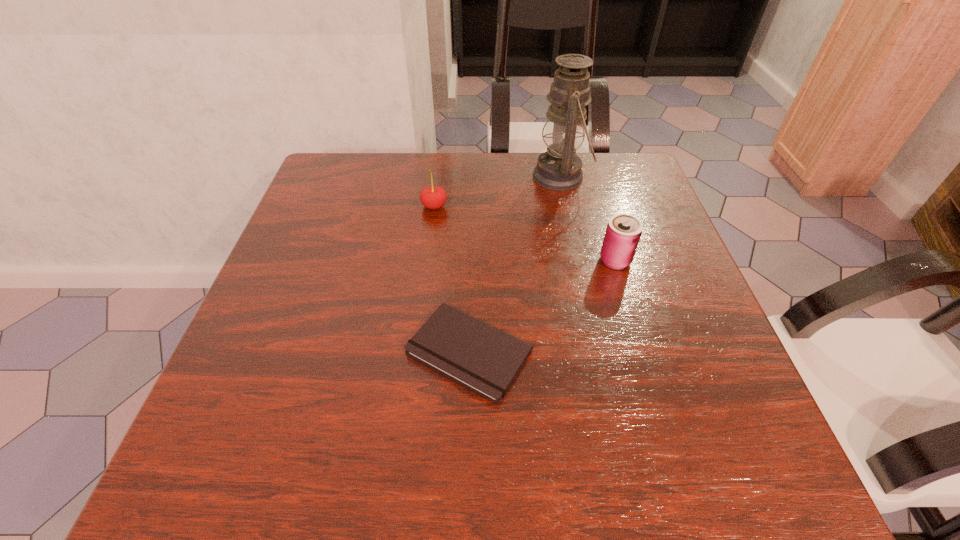
Identify the location of object that is the closest one to the oil lamp. The width and height of the screenshot is (960, 540). (623, 232).

The height and width of the screenshot is (540, 960). Identify the location of free location that satisfies the following two spatial constraints: 1. on the front side of the third farthest object; 2. on the right side of the oil lamp. (580, 260).

I want to click on vacant space that satisfies the following two spatial constraints: 1. on the front side of the cherry; 2. on the right side of the shortest object, so click(x=417, y=351).

Find the location of a particular element. This screenshot has width=960, height=540. free space that satisfies the following two spatial constraints: 1. on the back side of the cherry; 2. on the left side of the oil lamp is located at coordinates (438, 177).

This screenshot has height=540, width=960. What are the coordinates of `free space that satisfies the following two spatial constraints: 1. on the front side of the oil lamp; 2. on the right side of the third farthest object` in the screenshot? It's located at (580, 260).